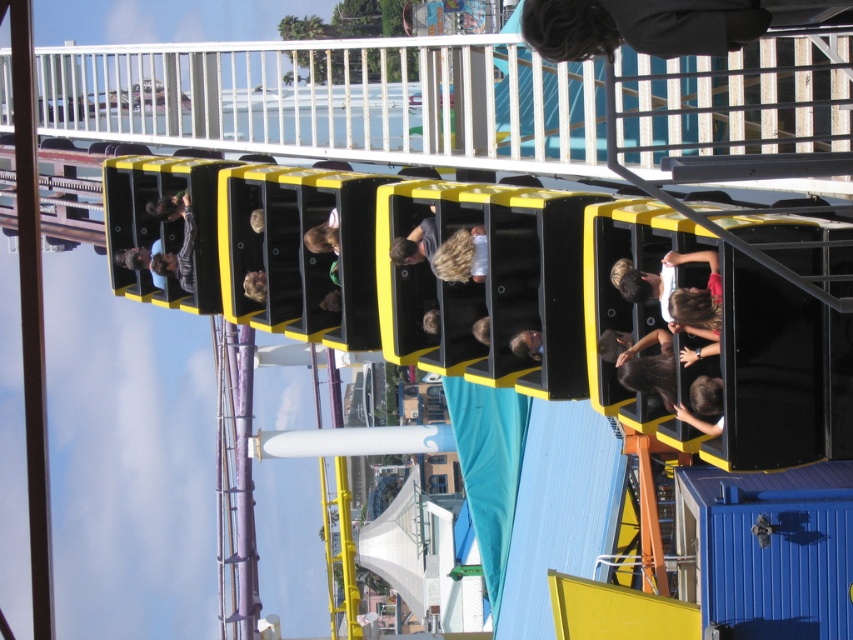
You are a photographer trying to capture the dark gray sweater at upper center in the image. What are the coordinates where you should focus your camera?

The dark gray sweater at upper center is located at coordinates point (640, 26).

You are a photographer taking a picture of the roller coaster riders. You notice two riders with different hairstyles at the center of the image. Which rider with matte black hair at center is located directly below the shiny brown hair at center?

The matte black hair at center is positioned under the shiny brown hair at center, so the rider with matte black hair at center is directly below the shiny brown hair at center.

You are a photographer trying to capture the best shot of the roller coaster. You have two points marked on your viewfinder at coordinates point (x=709, y=49) and point (x=675, y=378). Which point is closer to your camera lens?

Point (x=709, y=49) is closer to the camera lens than point (x=675, y=378).